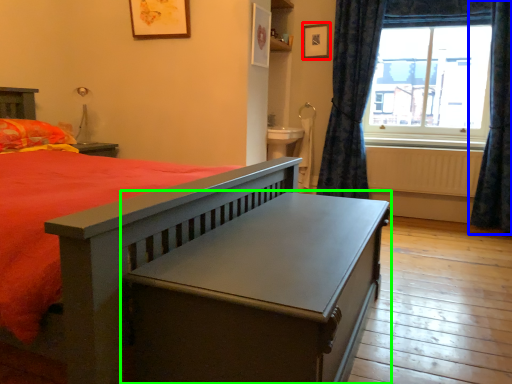
Question: Which object is the farthest from picture frame (highlighted by a red box)? Choose among these: curtain (highlighted by a blue box) or table (highlighted by a green box).

Choices:
 (A) curtain
 (B) table

Answer: (B)